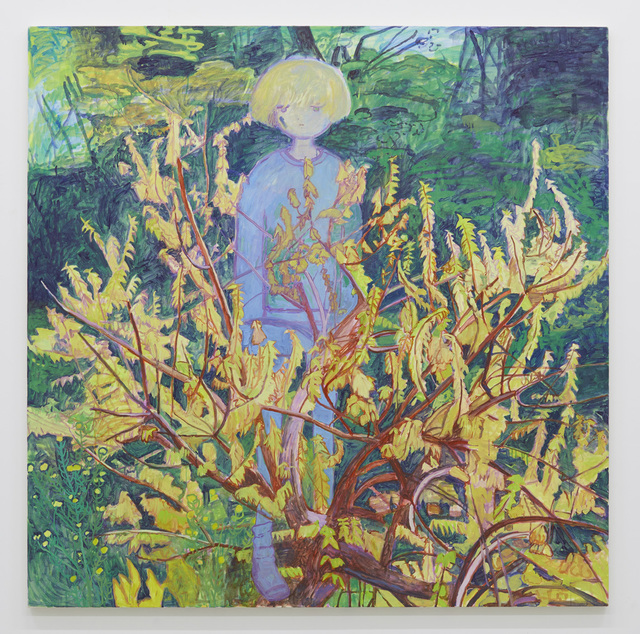
Find the location of a particular element. The height and width of the screenshot is (634, 640). illustrated colorful artwork is located at coordinates (457, 182).